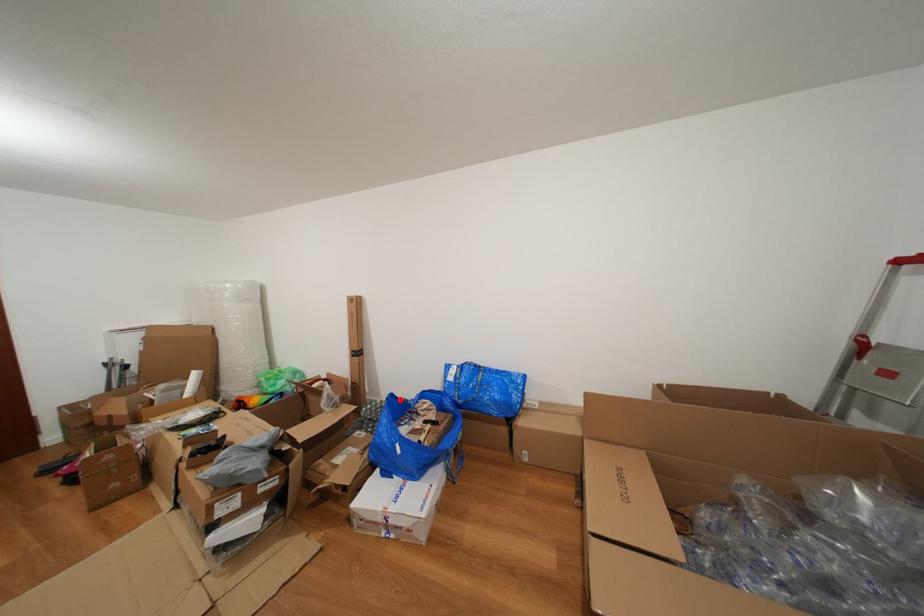
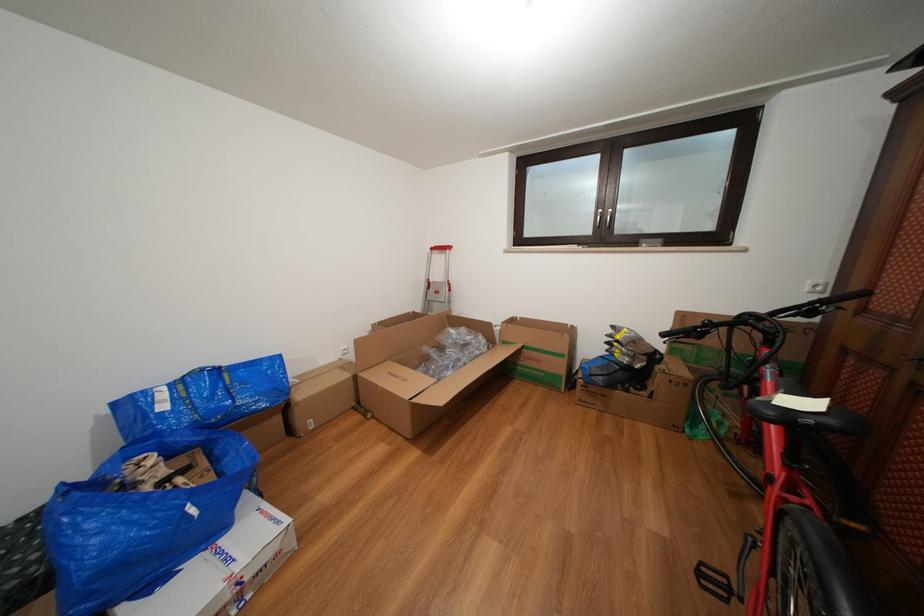
Question: A red point is marked in image1. In image2, is the corresponding 3D point closer to the camera or farther? Reply with the corresponding letter.

Choices:
 (A) The corresponding 3D point is closer.
 (B) The corresponding 3D point is farther.

Answer: (A)